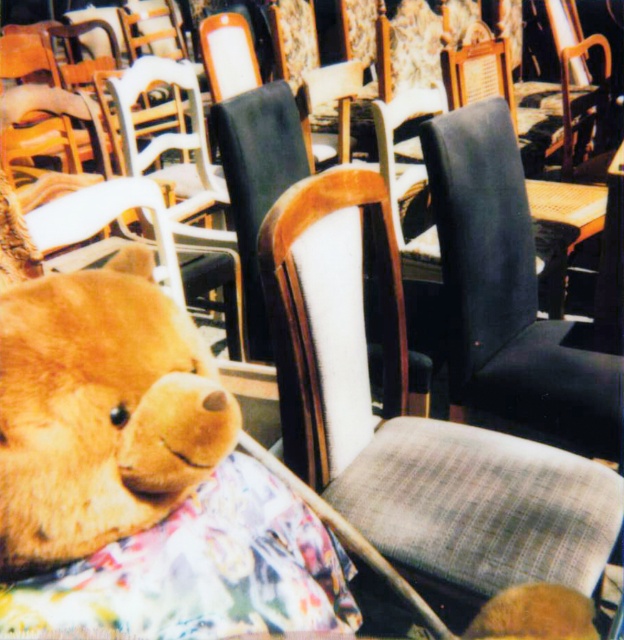
Does plaid fabric chair at center have a lesser width compared to fluffy brown teddy bear at lower left?

No.

Where is `plaid fabric chair at center`? The height and width of the screenshot is (640, 624). plaid fabric chair at center is located at coordinates point(409,419).

Does point (553, 554) come farther from viewer compared to point (203, 461)?

Yes, point (553, 554) is behind point (203, 461).

You are a GUI agent. You are given a task and a screenshot of the screen. Output one action in this format:
    pyautogui.click(x=<x>, y=<y>)
    Task: Click on the plaid fabric chair at center
    Image resolution: width=624 pixels, height=640 pixels.
    Given the screenshot: What is the action you would take?
    pyautogui.click(x=409, y=419)